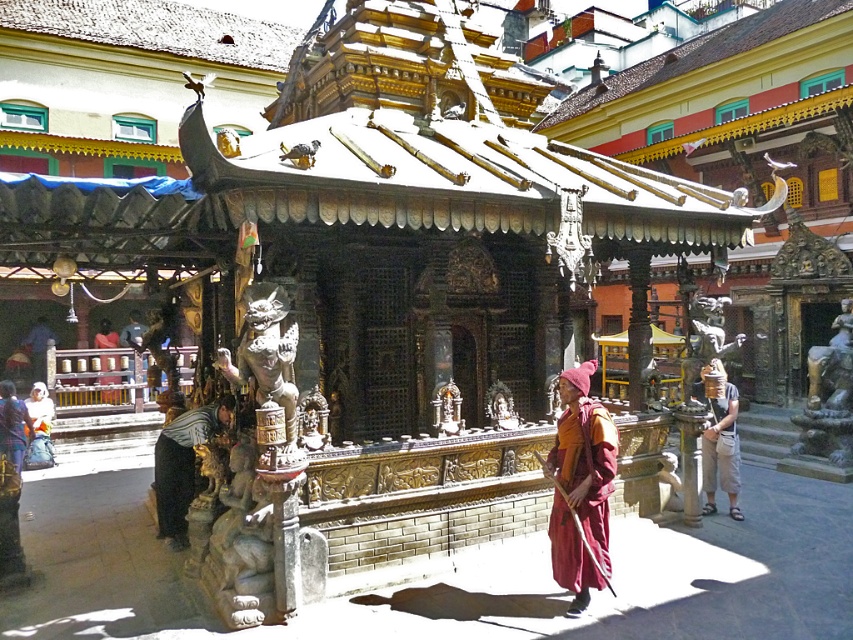
Can you confirm if bronze/golden statue at center is thinner than dark brown wooden statue at lower left?

Indeed, bronze/golden statue at center has a lesser width compared to dark brown wooden statue at lower left.

Can you confirm if bronze/golden statue at center is positioned below dark brown wooden statue at lower left?

No, bronze/golden statue at center is not below dark brown wooden statue at lower left.

Is point (219, 356) positioned behind point (26, 433)?

No, it is not.

The image size is (853, 640). What are the coordinates of `bronze/golden statue at center` in the screenshot? It's located at (265, 352).

Is bronze statue at right positioned before tan fabric hat at right?

That is False.

Is point (817, 396) positioned behind point (737, 397)?

Yes, point (817, 396) is farther from viewer.

I want to click on bronze statue at right, so click(x=828, y=401).

Which is more to the right, maroon woolen robe at center or bronze statue at right?

bronze statue at right

Can you confirm if maroon woolen robe at center is taller than bronze statue at right?

In fact, maroon woolen robe at center may be shorter than bronze statue at right.

Which is behind, point (555, 554) or point (851, 330)?

The point (851, 330) is more distant.

Image resolution: width=853 pixels, height=640 pixels. What are the coordinates of `maroon woolen robe at center` in the screenshot? It's located at (579, 484).